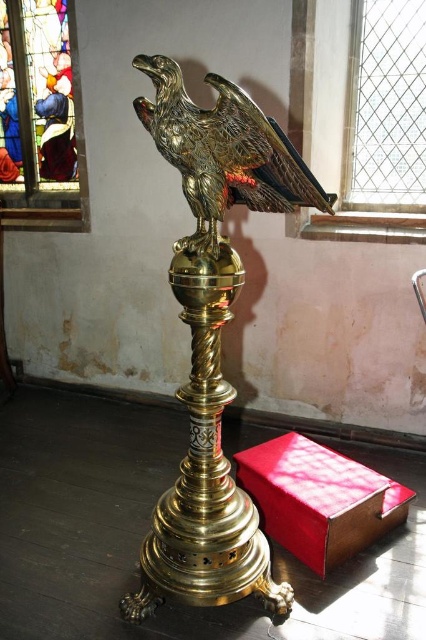
Question: Is stained glass at upper left in front of shiny gold eagle at center?

Choices:
 (A) no
 (B) yes

Answer: (A)

Question: Which of the following is the farthest from the observer?

Choices:
 (A) (310, 461)
 (B) (48, 212)
 (C) (155, 557)
 (D) (230, 104)

Answer: (B)

Question: Can you confirm if gold polished eagle at center is wider than smooth red leather table at lower center?

Choices:
 (A) yes
 (B) no

Answer: (B)

Question: Does stained glass at upper left appear on the right side of clear glass window at upper right?

Choices:
 (A) yes
 (B) no

Answer: (B)

Question: Which object is positioned closest to the gold polished eagle at center?

Choices:
 (A) clear glass window at upper right
 (B) smooth red leather table at lower center

Answer: (B)

Question: Which point is farther to the camera?

Choices:
 (A) gold polished eagle at center
 (B) smooth red leather table at lower center
 (C) shiny gold eagle at center
 (D) stained glass at upper left

Answer: (D)